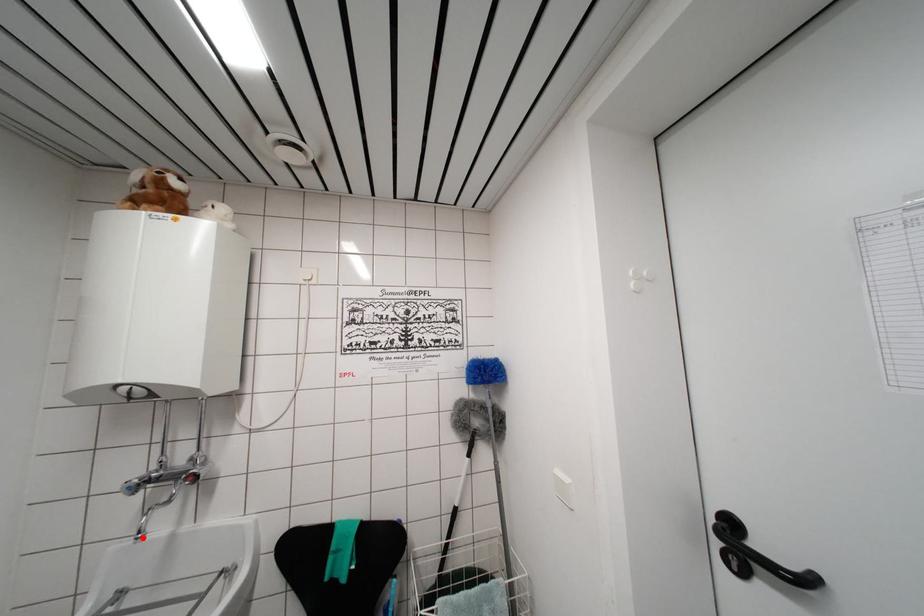
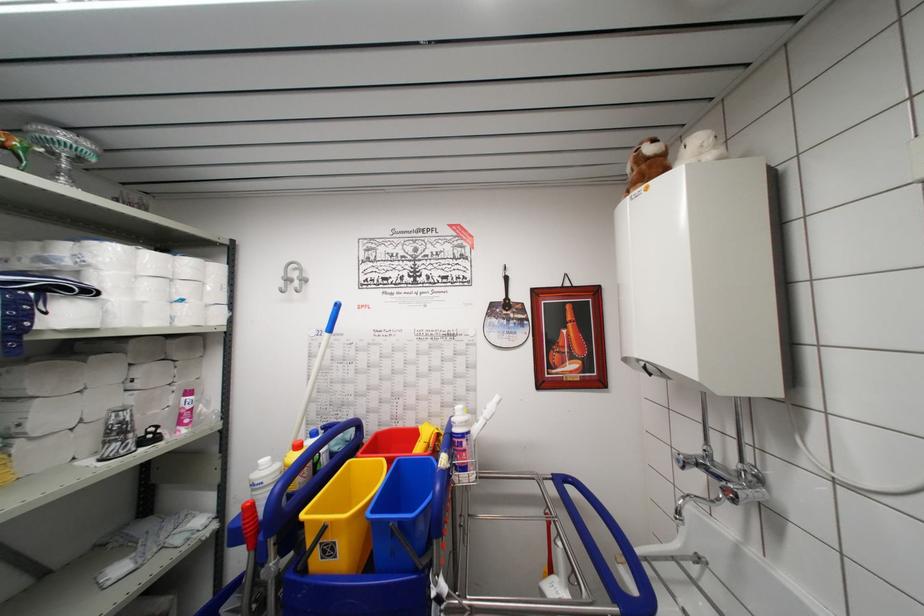
The point at the highlighted location is marked in the first image. Where is the corresponding point in the second image?

(681, 517)